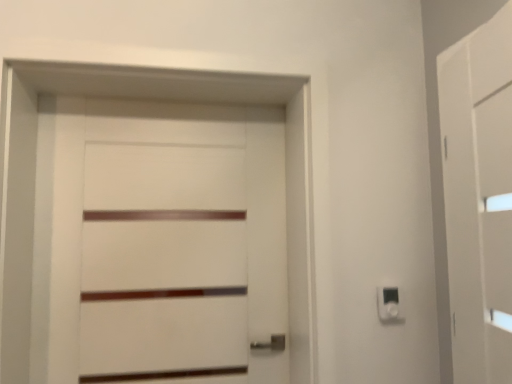
Question: From a real-world perspective, is white plastic light switch at lower right physically below white matte door at center?

Choices:
 (A) no
 (B) yes

Answer: (B)

Question: Can you confirm if white plastic light switch at lower right is wider than white matte door at center?

Choices:
 (A) no
 (B) yes

Answer: (A)

Question: Is the surface of white plastic light switch at lower right in direct contact with white matte door at center?

Choices:
 (A) yes
 (B) no

Answer: (B)

Question: Is white plastic light switch at lower right bigger than white matte door at center?

Choices:
 (A) no
 (B) yes

Answer: (A)

Question: Is white plastic light switch at lower right not inside white matte door at center?

Choices:
 (A) yes
 (B) no

Answer: (A)

Question: Is white matte door at center inside white plastic light switch at lower right?

Choices:
 (A) no
 (B) yes

Answer: (A)

Question: Does white matte door at center have a greater width compared to white plastic light switch at lower right?

Choices:
 (A) yes
 (B) no

Answer: (A)

Question: From the image's perspective, does white matte door at center appear higher than white plastic light switch at lower right?

Choices:
 (A) yes
 (B) no

Answer: (A)

Question: Can you confirm if white matte door at center is thinner than white plastic light switch at lower right?

Choices:
 (A) no
 (B) yes

Answer: (A)

Question: Is white matte door at center outside of white plastic light switch at lower right?

Choices:
 (A) no
 (B) yes

Answer: (B)

Question: Can you confirm if white matte door at center is smaller than white plastic light switch at lower right?

Choices:
 (A) no
 (B) yes

Answer: (A)

Question: Does white matte door at center appear on the left side of white plastic light switch at lower right?

Choices:
 (A) no
 (B) yes

Answer: (B)

Question: Is white matte barn door at right not close to white plastic light switch at lower right?

Choices:
 (A) yes
 (B) no

Answer: (B)